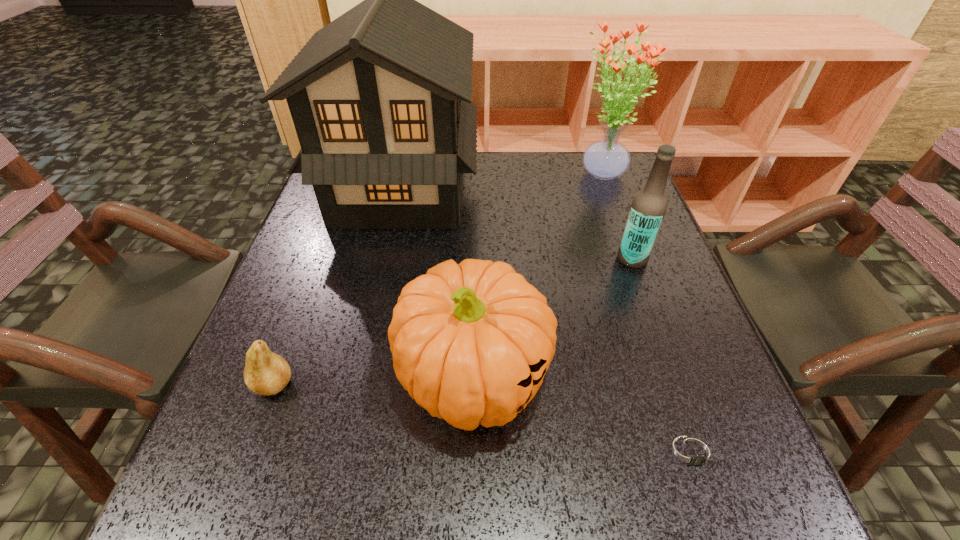
Identify the location of the tallest object. (380, 98).

Where is `flower arrangement`? flower arrangement is located at coordinates (606, 159).

At what (x,y) coordinates should I click in order to perform the action: click on the fourth nearest object. Please return your answer as a coordinate pair (x, y). This screenshot has height=540, width=960. Looking at the image, I should click on (648, 208).

Locate an element on the screen. The image size is (960, 540). pumpkin is located at coordinates (x=471, y=342).

Identify the location of pear. The image size is (960, 540). (266, 373).

I want to click on the shortest object, so click(x=691, y=452).

The image size is (960, 540). I want to click on free location located on the front-facing side of the dollhouse, so 545,191.

I want to click on free region located 0.070m on the left of the flower arrangement, so point(542,175).

This screenshot has height=540, width=960. I want to click on free space located on the label of the fourth nearest object, so click(541, 259).

Where is `free spot located on the label of the fourth nearest object`? This screenshot has width=960, height=540. free spot located on the label of the fourth nearest object is located at coordinates (537, 259).